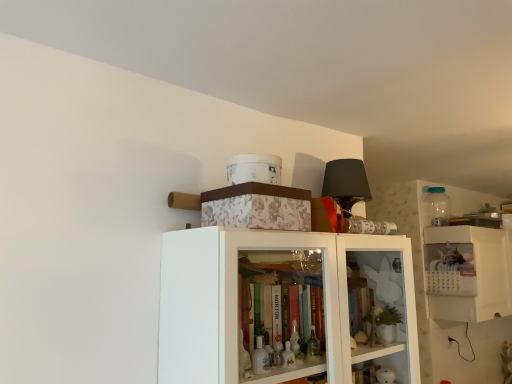
Question: From the image's perspective, is white plastic calendar at upper right over white floral-patterned box at upper center?

Choices:
 (A) yes
 (B) no

Answer: (B)

Question: Could you tell me if white plastic calendar at upper right is turned towards white floral-patterned box at upper center?

Choices:
 (A) no
 (B) yes

Answer: (A)

Question: Can you confirm if white plastic calendar at upper right is positioned to the right of white floral-patterned box at upper center?

Choices:
 (A) yes
 (B) no

Answer: (A)

Question: Is white plastic calendar at upper right taller than white floral-patterned box at upper center?

Choices:
 (A) yes
 (B) no

Answer: (A)

Question: Is white plastic calendar at upper right looking in the opposite direction of white floral-patterned box at upper center?

Choices:
 (A) yes
 (B) no

Answer: (B)

Question: Is white floral-patterned box at upper center situated inside white plastic calendar at upper right or outside?

Choices:
 (A) inside
 (B) outside

Answer: (B)

Question: Is white floral-patterned box at upper center bigger or smaller than white plastic calendar at upper right?

Choices:
 (A) small
 (B) big

Answer: (A)

Question: Is white floral-patterned box at upper center in front of or behind white plastic calendar at upper right in the image?

Choices:
 (A) behind
 (B) front

Answer: (B)

Question: Is white floral-patterned box at upper center to the left or to the right of white plastic calendar at upper right in the image?

Choices:
 (A) right
 (B) left

Answer: (B)

Question: From a real-world perspective, is white floral-patterned box at upper center positioned above or below transparent plastic bottle at upper right?

Choices:
 (A) above
 (B) below

Answer: (B)

Question: Do you think white floral-patterned box at upper center is within transparent plastic bottle at upper right, or outside of it?

Choices:
 (A) outside
 (B) inside

Answer: (A)

Question: Does point (262, 211) appear closer or farther from the camera than point (432, 190)?

Choices:
 (A) closer
 (B) farther

Answer: (A)

Question: Considering the positions of white floral-patterned box at upper center and transparent plastic bottle at upper right in the image, is white floral-patterned box at upper center bigger or smaller than transparent plastic bottle at upper right?

Choices:
 (A) big
 (B) small

Answer: (A)

Question: Relative to white floral-patterned box at upper center, is white plastic calendar at upper right in front or behind?

Choices:
 (A) front
 (B) behind

Answer: (B)

Question: In terms of height, does white plastic calendar at upper right look taller or shorter compared to white floral-patterned box at upper center?

Choices:
 (A) short
 (B) tall

Answer: (B)